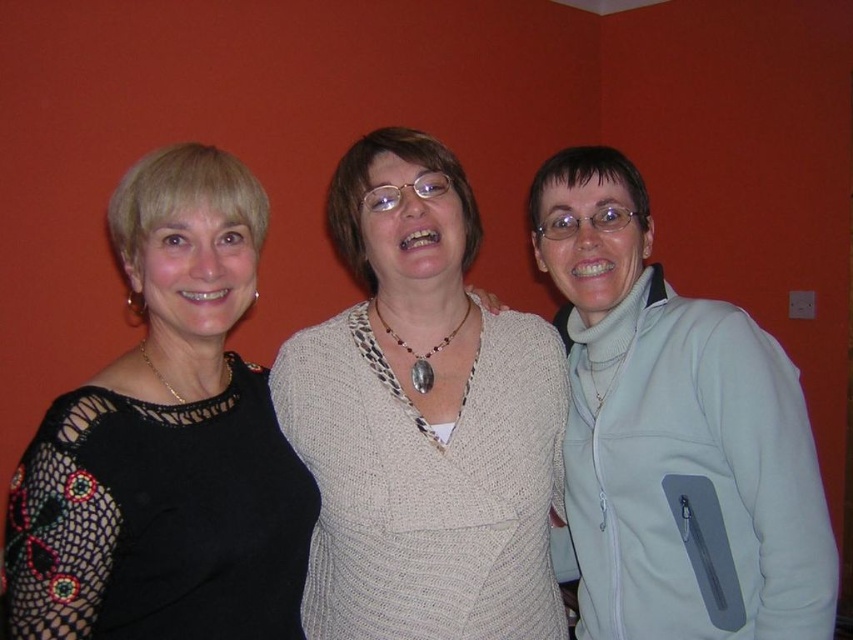
Who is more forward, (x=73, y=465) or (x=578, y=637)?

Point (x=73, y=465) is in front.

Which is more to the left, black lace dress at left or light blue fleece jacket at right?

black lace dress at left

Between point (257, 252) and point (738, 579), which one is positioned in front?

Point (738, 579) is more forward.

The image size is (853, 640). In order to click on black lace dress at left in this screenshot , I will do `click(166, 442)`.

Who is more forward, [404,241] or [790,445]?

Positioned in front is point [790,445].

This screenshot has height=640, width=853. Find the location of `white knitted sweater at center`. white knitted sweater at center is located at coordinates (422, 419).

Who is more distant from viewer, (523, 573) or (207, 212)?

The point (523, 573) is more distant.

Is white knitted sweater at center smaller than black lace dress at left?

Incorrect, white knitted sweater at center is not smaller in size than black lace dress at left.

Describe the element at coordinates (422, 419) in the screenshot. I see `white knitted sweater at center` at that location.

You are a GUI agent. You are given a task and a screenshot of the screen. Output one action in this format:
    pyautogui.click(x=<x>, y=<y>)
    Task: Click on the white knitted sweater at center
    The height and width of the screenshot is (640, 853).
    Given the screenshot: What is the action you would take?
    pyautogui.click(x=422, y=419)